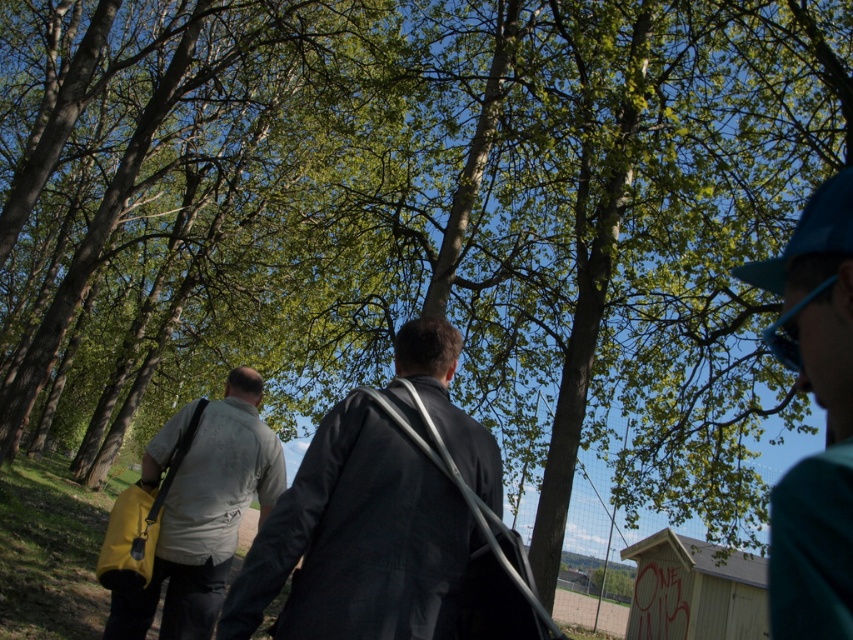
You are a photographer trying to capture both the teal fabric cap at upper right and the blue fabric baseball cap at upper right in a single shot. Based on their positions, which cap would appear closer to the camera in the photo?

The teal fabric cap at upper right appears closer to the camera because it is in front of the blue fabric baseball cap at upper right.

You are a photographer trying to capture a photo of the teal fabric cap at upper right and the blue fabric baseball cap at upper right. Which cap should you adjust your camera to focus on first if you want to capture them in order from left to right?

The teal fabric cap at upper right is positioned on the left side of blue fabric baseball cap at upper right, so you should focus on the teal fabric cap at upper right first.